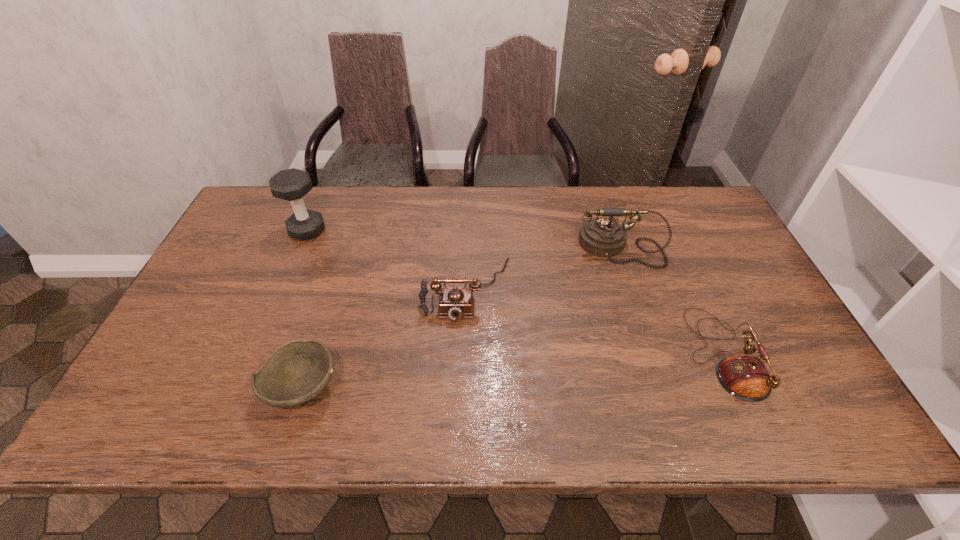
This screenshot has height=540, width=960. Identify the location of the tallest object. pos(292,184).

Where is `the fourth shortest object`? the fourth shortest object is located at coordinates (605, 237).

At what (x,y) coordinates should I click in order to perform the action: click on the leftmost telephone. Please return your answer as a coordinate pair (x, y). This screenshot has width=960, height=540. Looking at the image, I should click on (455, 303).

This screenshot has height=540, width=960. What are the coordinates of `the shortest object` in the screenshot? It's located at (296, 372).

What are the coordinates of `free region located 0.150m on the left of the tallest object` in the screenshot? It's located at (241, 231).

Find the location of a particular element. This screenshot has width=960, height=540. vacant space located 0.350m on the front of the tallest telephone is located at coordinates (660, 375).

Where is `free space located 0.220m on the dial of the third object from left to right`? This screenshot has width=960, height=540. free space located 0.220m on the dial of the third object from left to right is located at coordinates click(x=464, y=405).

You are a GUI agent. You are given a task and a screenshot of the screen. Output one action in this format:
    pyautogui.click(x=<x>, y=<y>)
    Task: Click on the vacant region located 0.200m on the back of the bowl
    The width and height of the screenshot is (960, 540).
    Given the screenshot: What is the action you would take?
    pyautogui.click(x=331, y=295)

This screenshot has width=960, height=540. I want to click on dumbbell that is at the far edge, so click(x=292, y=184).

Locate an element on the screen. telephone that is positioned at the far edge is located at coordinates (605, 237).